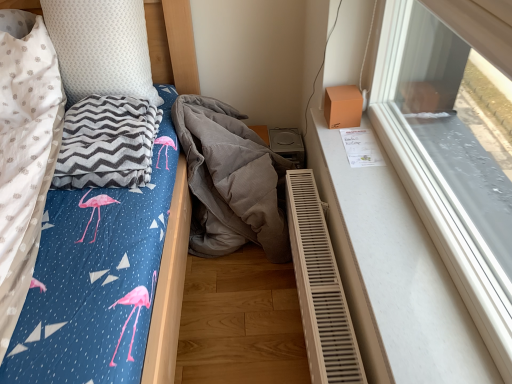
Question: Considering the positions of gray zigzag blanket at left and transparent glass window at upper right in the image, is gray zigzag blanket at left taller or shorter than transparent glass window at upper right?

Choices:
 (A) short
 (B) tall

Answer: (A)

Question: Do you think gray zigzag blanket at left is within transparent glass window at upper right, or outside of it?

Choices:
 (A) inside
 (B) outside

Answer: (B)

Question: Which object is the closest to the white dotted pillow at upper left?

Choices:
 (A) gray zigzag blanket at left
 (B) beige plastic radiator at lower right
 (C) transparent glass window at upper right
 (D) gray corduroy blanket at center

Answer: (A)

Question: Based on their relative distances, which object is nearer to the gray corduroy blanket at center?

Choices:
 (A) beige plastic radiator at lower right
 (B) transparent glass window at upper right
 (C) white dotted pillow at upper left
 (D) gray zigzag blanket at left

Answer: (A)